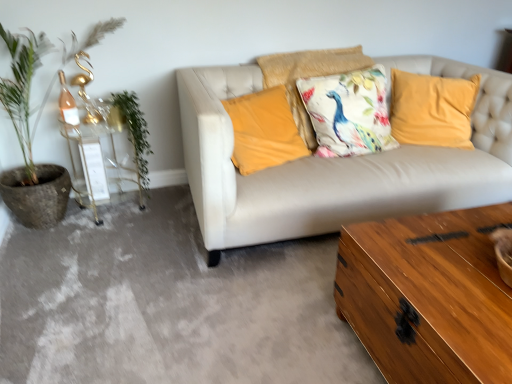
Question: Does point (266, 369) appear closer or farther from the camera than point (336, 51)?

Choices:
 (A) farther
 (B) closer

Answer: (B)

Question: In terms of width, does wooden chest at lower right look wider or thinner when compared to floral fabric cushion at center, which ranks as the second pillow in right-to-left order?

Choices:
 (A) thin
 (B) wide

Answer: (B)

Question: Estimate the real-world distances between objects in this image. Which object is farther from the floral cotton cushion at center, which ranks as the 3th pillow in left-to-right order?

Choices:
 (A) floral fabric cushion at center, which ranks as the second pillow in right-to-left order
 (B) green leafy plant at left
 (C) wooden chest at lower right
 (D) shiny brown wooden trunk at lower right
 (E) velvet yellow pillow at center, the 3th pillow when ordered from right to left

Answer: (B)

Question: Based on their relative distances, which object is nearer to the wooden chest at lower right?

Choices:
 (A) gold metallic table lamp at left
 (B) clear glass side table at left
 (C) green leafy plant at left
 (D) green leafy plant at left
 (E) velvet yellow pillow at center, the 3th pillow when ordered from right to left

Answer: (B)